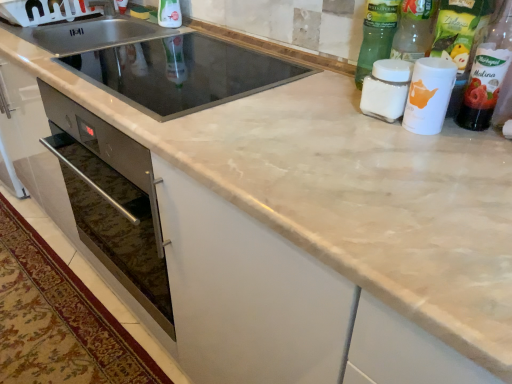
Where is `free space in front of white plastic cup at upper right, the second bottle positioned from the right`? This screenshot has height=384, width=512. free space in front of white plastic cup at upper right, the second bottle positioned from the right is located at coordinates (452, 142).